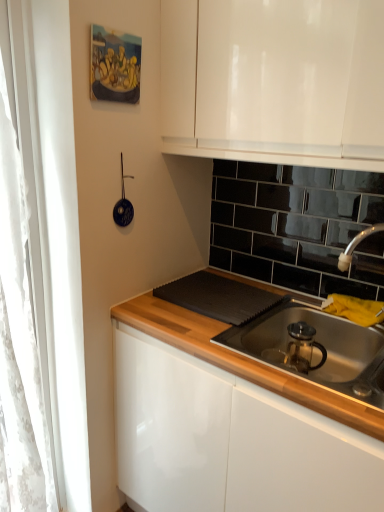
Question: From the image's perspective, is blue glossy strainer at upper left positioned above or below white lace curtain at left?

Choices:
 (A) below
 (B) above

Answer: (B)

Question: Considering the positions of blue glossy strainer at upper left and white lace curtain at left in the image, is blue glossy strainer at upper left taller or shorter than white lace curtain at left?

Choices:
 (A) short
 (B) tall

Answer: (A)

Question: Which object is positioned farthest from the stainless steel sink at lower right?

Choices:
 (A) blue glossy strainer at upper left
 (B) white lace curtain at left

Answer: (B)

Question: Estimate the real-world distances between objects in this image. Which object is closer to the white lace curtain at left?

Choices:
 (A) blue glossy strainer at upper left
 (B) stainless steel sink at lower right

Answer: (A)